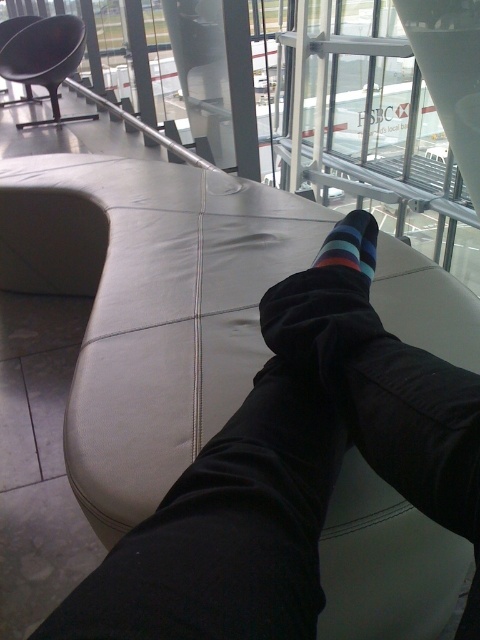
Question: Is matte black pants at center to the right of striped cotton sock at center from the viewer's perspective?

Choices:
 (A) yes
 (B) no

Answer: (B)

Question: Which point appears farthest from the camera in this image?

Choices:
 (A) (54, 38)
 (B) (331, 260)
 (C) (475, 392)

Answer: (A)

Question: Which point is closer to the camera taking this photo?

Choices:
 (A) (207, 449)
 (B) (367, 246)

Answer: (A)

Question: Can you confirm if matte black pants at center is thinner than matte black chair at upper left?

Choices:
 (A) yes
 (B) no

Answer: (A)

Question: Is matte black pants at center closer to camera compared to matte black chair at upper left?

Choices:
 (A) yes
 (B) no

Answer: (A)

Question: Which object is the closest to the striped cotton sock at center?

Choices:
 (A) matte black chair at upper left
 (B) matte black pants at center

Answer: (B)